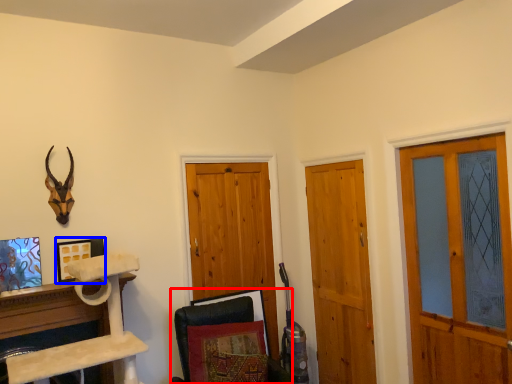
Question: Which object appears closest to the camera in this image, swivel chair (highlighted by a red box) or picture frame (highlighted by a blue box)?

Choices:
 (A) swivel chair
 (B) picture frame

Answer: (A)